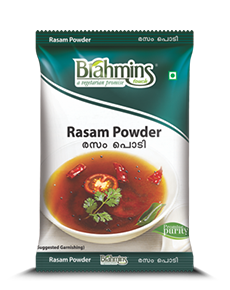
You are a GUI agent. You are given a task and a screenshot of the screen. Output one action in this format:
    pyautogui.click(x=<x>, y=<y>)
    Task: Click on the corner
    This screenshot has width=230, height=290.
    Given the screenshot: What is the action you would take?
    pyautogui.click(x=37, y=30), pyautogui.click(x=192, y=30), pyautogui.click(x=37, y=269), pyautogui.click(x=191, y=270)